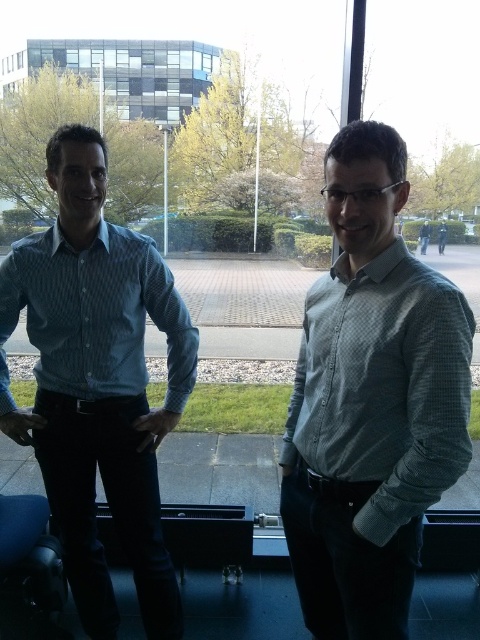
You are a photographer setting up for a group photo. You need to position two people wearing checkered shirts so that there is enough space between them for a small table. The table requires at least 24 inches of space. Based on the current positions of the light blue checkered shirt at center and blue checkered shirt at left, will the table fit between them?

The light blue checkered shirt at center and blue checkered shirt at left are 26.21 inches apart, which is more than the required 24 inches. Therefore, the small table will fit between them.

You are a tailor measuring shirts for alterations. You have two shirts in front of you, the light blue checkered shirt at center and the blue checkered shirt at left. Which shirt has a narrower width that might require adjustments for a better fit?

The light blue checkered shirt at center has a lesser width compared to the blue checkered shirt at left, so it is narrower and may need adjustments for a better fit.

You are an event planner arranging a photoshoot. You need to position two models wearing the light blue checkered shirt at center and the blue checkered shirt at left. According to the scene, which model should stand to the right side to maintain the original spatial arrangement?

The light blue checkered shirt at center should stand to the right side of the blue checkered shirt at left to maintain the original spatial arrangement as described.